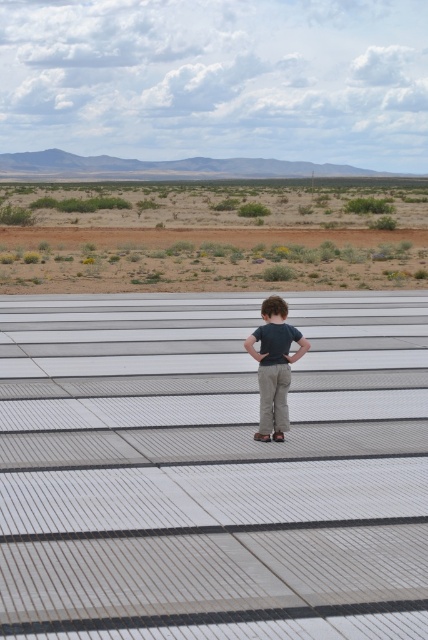
Question: Which point appears closest to the camera in this image?

Choices:
 (A) (351, 208)
 (B) (267, 419)

Answer: (B)

Question: Which object is farther from the camera taking this photo?

Choices:
 (A) matte khaki pants at center
 (B) desert shrubs at lower center

Answer: (B)

Question: Which object appears farthest from the camera in this image?

Choices:
 (A) matte khaki pants at center
 (B) desert shrubs at lower center

Answer: (B)

Question: Observing the image, what is the correct spatial positioning of desert shrubs at lower center in reference to matte khaki pants at center?

Choices:
 (A) right
 (B) left

Answer: (B)

Question: Can you confirm if desert shrubs at lower center is positioned below matte khaki pants at center?

Choices:
 (A) no
 (B) yes

Answer: (A)

Question: Does desert shrubs at lower center come in front of matte khaki pants at center?

Choices:
 (A) no
 (B) yes

Answer: (A)